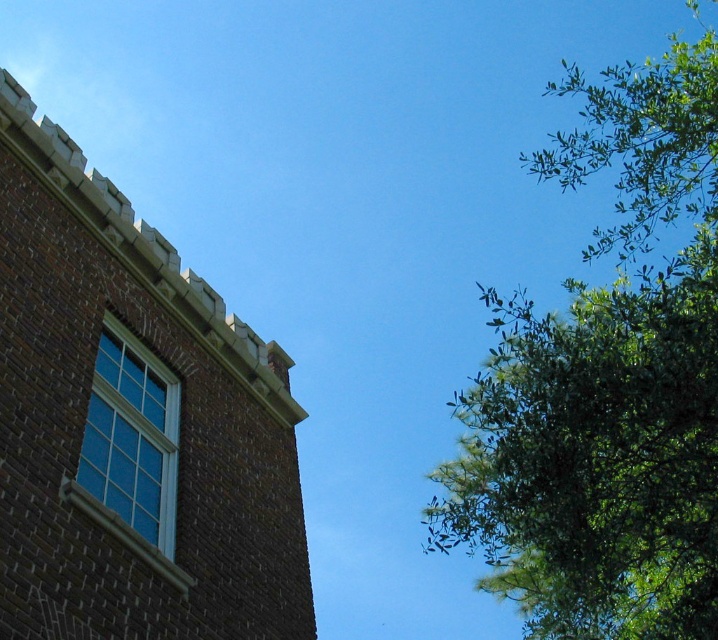
Question: Which object is positioned closest to the matte glass window at upper left?

Choices:
 (A) brown brick tower at upper left
 (B) green leafy tree at upper right

Answer: (A)

Question: Does green leafy tree at upper right have a lesser width compared to matte glass window at upper left?

Choices:
 (A) yes
 (B) no

Answer: (B)

Question: Can you confirm if green leafy tree at upper right is wider than matte glass window at upper left?

Choices:
 (A) yes
 (B) no

Answer: (A)

Question: Which point is closer to the camera?

Choices:
 (A) (167, 477)
 (B) (536, 356)

Answer: (B)

Question: Which object is farther from the camera taking this photo?

Choices:
 (A) matte glass window at upper left
 (B) green leafy tree at upper right

Answer: (A)

Question: Can you confirm if green leafy tree at upper right is wider than matte glass window at upper left?

Choices:
 (A) no
 (B) yes

Answer: (B)